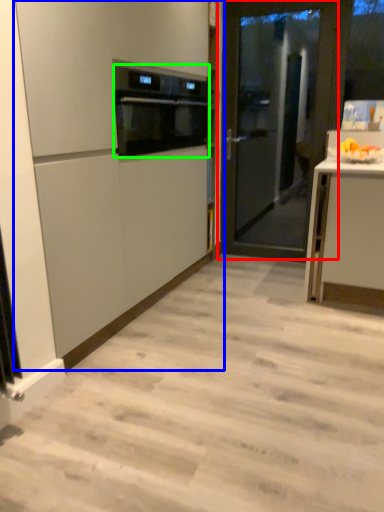
Question: Considering the real-world distances, which object is farthest from door (highlighted by a red box)? cabinetry (highlighted by a blue box) or kitchen appliance (highlighted by a green box)?

Choices:
 (A) cabinetry
 (B) kitchen appliance

Answer: (A)